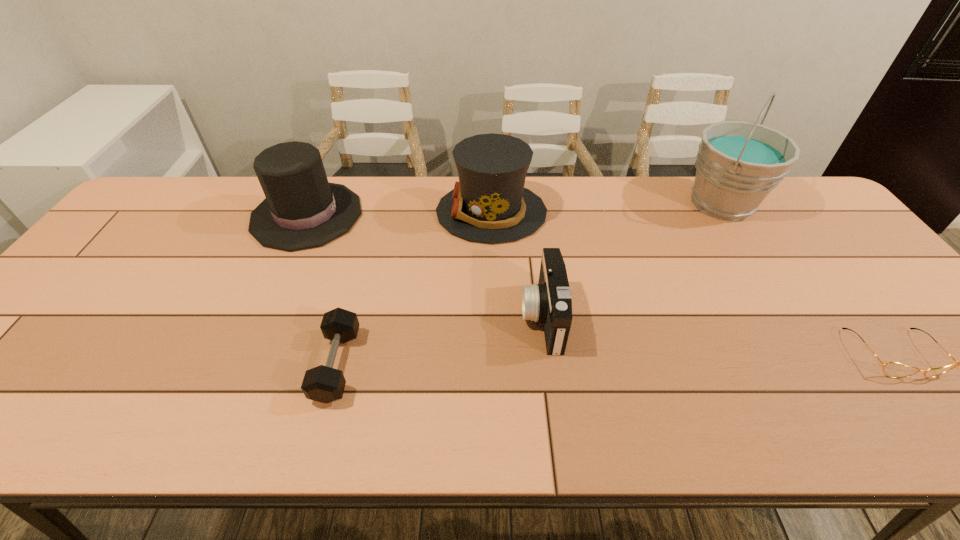
The width and height of the screenshot is (960, 540). Find the location of `bucket`. bucket is located at coordinates (738, 164).

Identify the location of the right dress hat. This screenshot has height=540, width=960. (489, 204).

The height and width of the screenshot is (540, 960). In order to click on the left dress hat in this screenshot , I will do pyautogui.click(x=302, y=210).

Locate an element on the screen. The height and width of the screenshot is (540, 960). the third shortest object is located at coordinates (549, 301).

Identify the location of the second object from left to right. (325, 384).

This screenshot has width=960, height=540. I want to click on dumbbell, so click(x=325, y=384).

This screenshot has height=540, width=960. What are the coordinates of `the shortest object` in the screenshot? It's located at (891, 369).

Find the location of a particular element. The image size is (960, 540). vacant space located on the front of the bucket is located at coordinates (789, 311).

Where is `vacant area situated 0.340m with goggles on the front of the right dress hat`? The height and width of the screenshot is (540, 960). vacant area situated 0.340m with goggles on the front of the right dress hat is located at coordinates (325, 212).

Where is `free space located with goggles on the front of the right dress hat`? free space located with goggles on the front of the right dress hat is located at coordinates (365, 212).